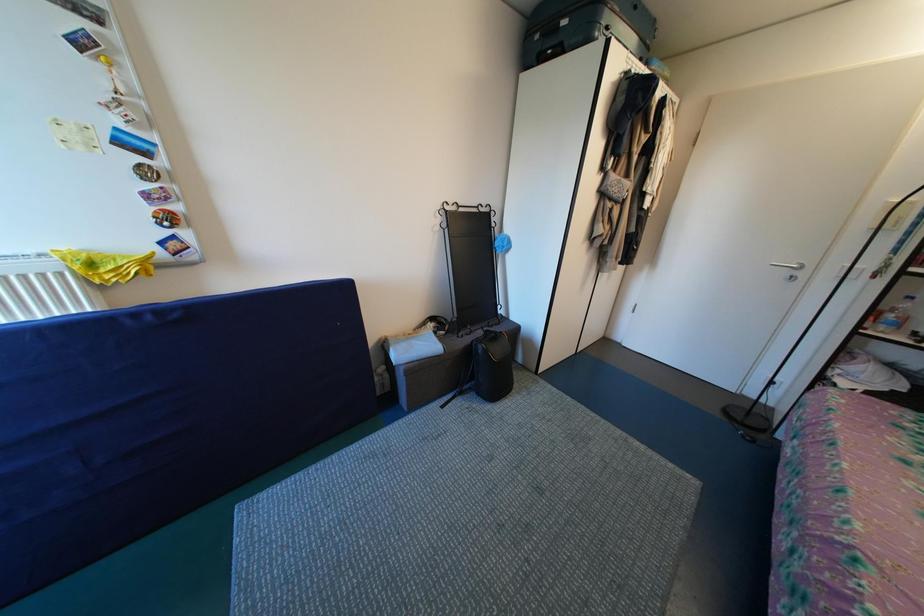
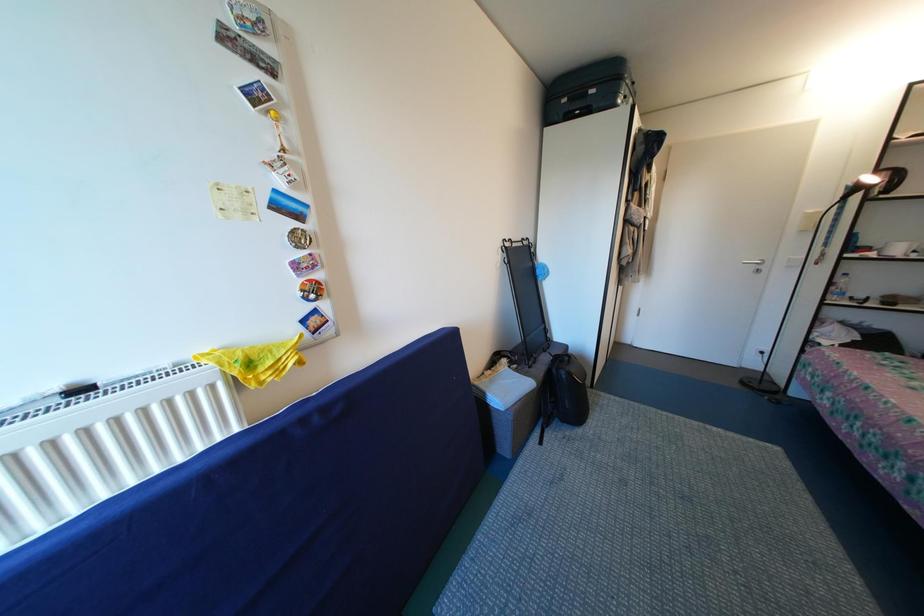
Question: What movement of the cameraman would produce the second image?

Choices:
 (A) Left
 (B) Right
 (C) Forward
 (D) Backward

Answer: (A)